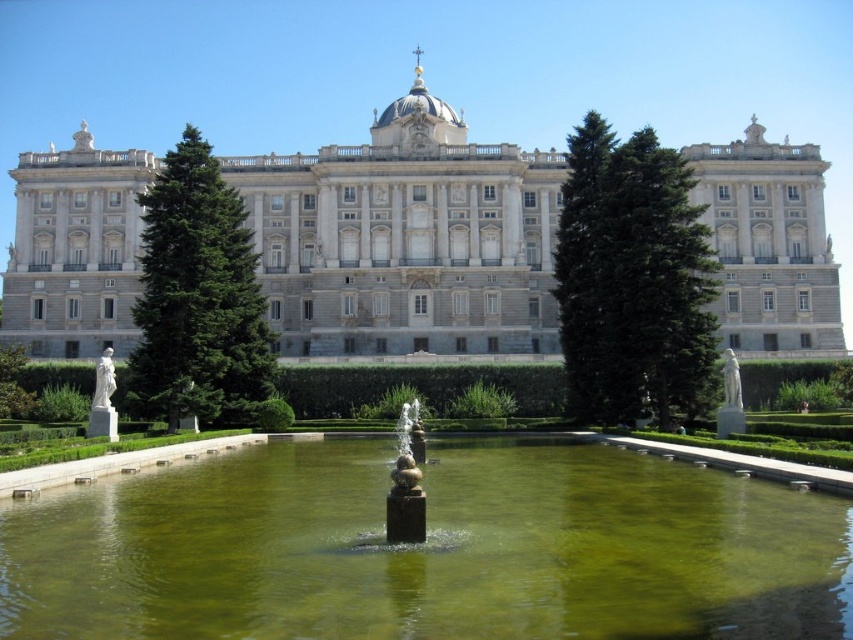
Looking at this image, you are standing in front of the building and want to take a photo that includes both the green water at center and the green glossy tree at center. Which one will appear larger in the photo?

The green water at center will appear larger in the photo because it is closer to the viewer than the green glossy tree at center.

You are a photographer planning to capture the white stone palace at center and the green textured tree at center in a single shot. Based on their sizes, which object should you focus on to ensure both are clearly visible in the photo?

The white stone palace at center is larger than the green textured tree at center, so focusing on the palace will help ensure both are clearly visible in the photo.

You are standing in the garden looking towards the building. The white stone palace at center and the green textured tree at center are both in your line of sight. Which one appears closer to you?

The green textured tree at center appears closer because it is positioned below the white stone palace at center, which is located above it.